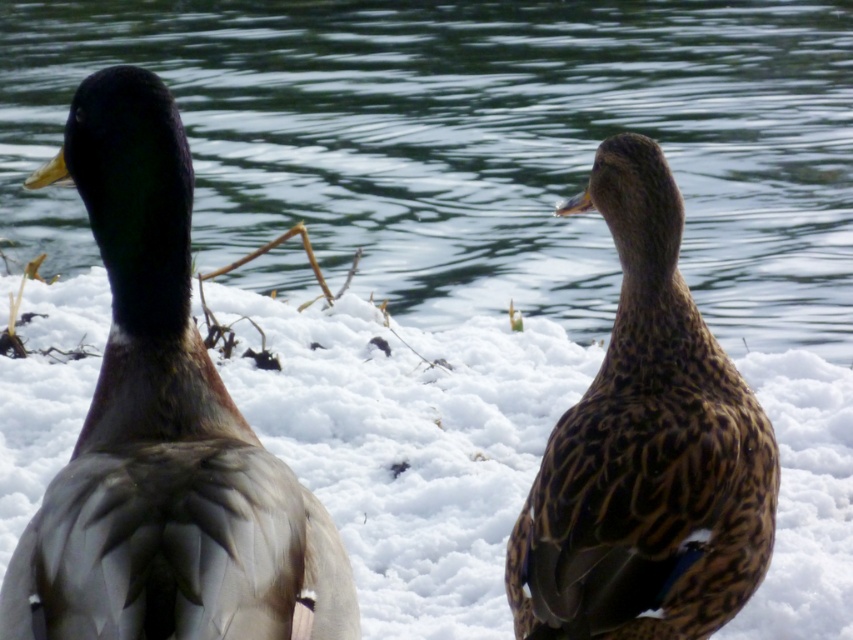
Is white fluffy snow at center bigger than matte brown duck at left?

Correct, white fluffy snow at center is larger in size than matte brown duck at left.

What are the coordinates of `white fluffy snow at center` in the screenshot? It's located at (409, 445).

Who is more forward, [293,280] or [329,419]?

Point [329,419] is in front.

Does glossy water at center have a lesser width compared to white fluffy snow at center?

Correct, glossy water at center's width is less than white fluffy snow at center's.

Is point (360, 148) more distant than point (548, 369)?

Yes, it is behind point (548, 369).

Identify the location of glossy water at center. This screenshot has height=640, width=853. (474, 145).

Between point (370, 172) and point (144, 170), which one is positioned behind?

Positioned behind is point (370, 172).

Locate an element on the screen. This screenshot has width=853, height=640. glossy water at center is located at coordinates (474, 145).

The image size is (853, 640). Describe the element at coordinates (474, 145) in the screenshot. I see `glossy water at center` at that location.

This screenshot has height=640, width=853. I want to click on glossy water at center, so click(474, 145).